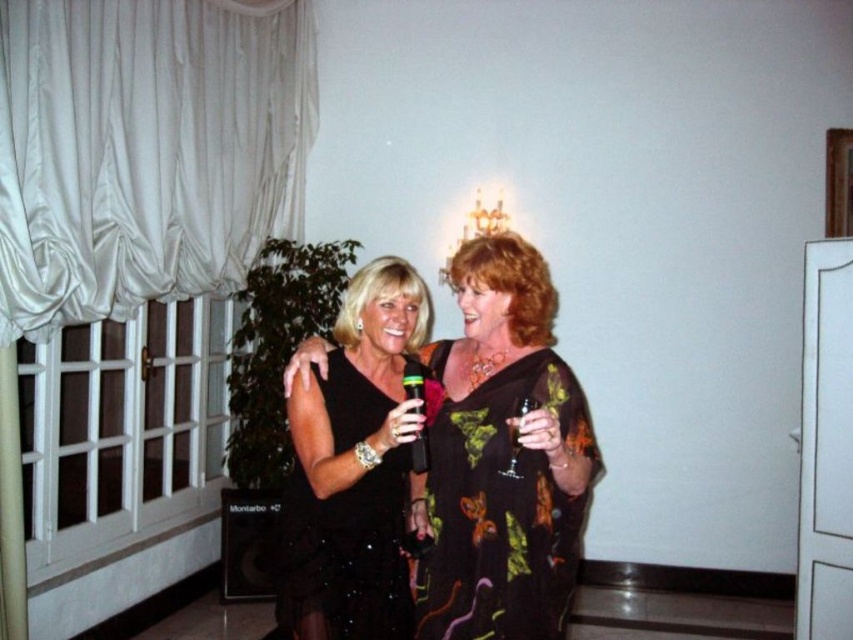
Does point (515, 518) lie behind point (341, 424)?

No, it is in front of (341, 424).

From the picture: Between floral print fabric dress at center and black sequined dress at center, which one appears on the right side from the viewer's perspective?

From the viewer's perspective, floral print fabric dress at center appears more on the right side.

Who is more distant from viewer, (437,417) or (357,408)?

The point (357,408) is behind.

You are a GUI agent. You are given a task and a screenshot of the screen. Output one action in this format:
    pyautogui.click(x=<x>, y=<y>)
    Task: Click on the floral print fabric dress at center
    This screenshot has height=640, width=853.
    Given the screenshot: What is the action you would take?
    pyautogui.click(x=503, y=509)

Is floral print fabric dress at center bigger than translucent plastic wine glass at center?

Yes.

What do you see at coordinates (503, 509) in the screenshot?
I see `floral print fabric dress at center` at bounding box center [503, 509].

This screenshot has height=640, width=853. In order to click on floral print fabric dress at center in this screenshot , I will do `click(503, 509)`.

Does translucent plastic wine glass at center have a greater height compared to clear glass wine glass at center?

Indeed, translucent plastic wine glass at center has a greater height compared to clear glass wine glass at center.

Which is in front, point (413, 372) or point (524, 412)?

Point (524, 412) is in front.

Find the location of a particular element. Image resolution: width=853 pixels, height=640 pixels. translucent plastic wine glass at center is located at coordinates (415, 384).

At what (x,y) coordinates should I click in order to perform the action: click on translucent plastic wine glass at center. Please return your answer as a coordinate pair (x, y). This screenshot has height=640, width=853. Looking at the image, I should click on (415, 384).